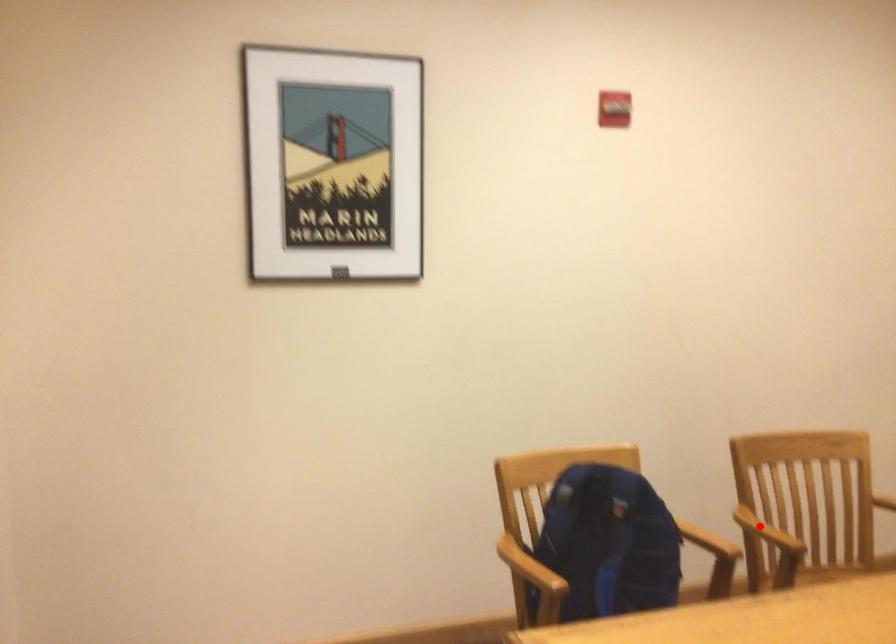
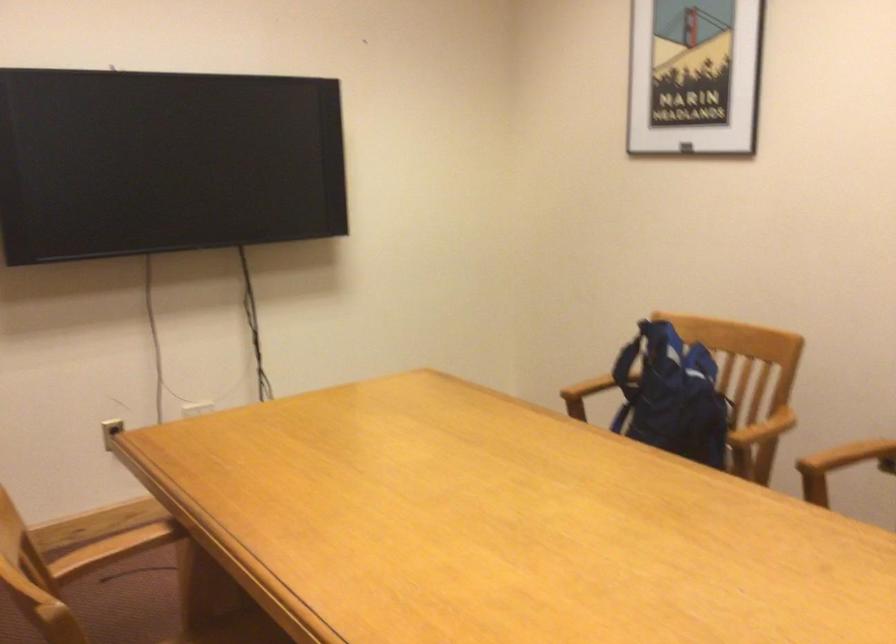
Question: I am providing you with two images of the same scene from different viewpoints. A red point is shown in image1. For the corresponding object point in image2, is it positioned nearer or farther from the camera?

Choices:
 (A) Nearer
 (B) Farther

Answer: (A)